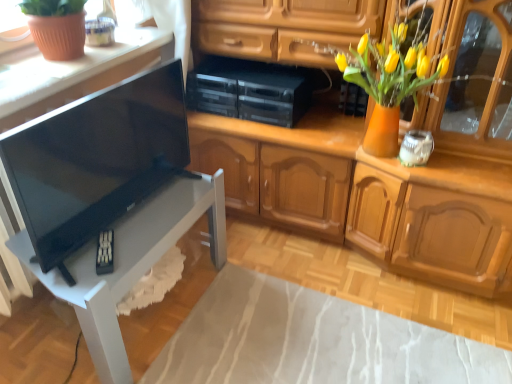
Question: Can you confirm if matte black speaker at upper center, the 2th appliance viewed from the right, is shorter than black plastic stereo at center, the first appliance from the left?

Choices:
 (A) yes
 (B) no

Answer: (B)

Question: Is matte black speaker at upper center, the 2th appliance viewed from the right, smaller than black plastic stereo at center, the first appliance from the left?

Choices:
 (A) yes
 (B) no

Answer: (A)

Question: Is matte black speaker at upper center, the 2th appliance viewed from the right, oriented towards black plastic stereo at center, the third appliance positioned from the right?

Choices:
 (A) no
 (B) yes

Answer: (A)

Question: From the image's perspective, is matte black speaker at upper center, which is the 2th appliance from left to right, located beneath black plastic stereo at center, the first appliance from the left?

Choices:
 (A) no
 (B) yes

Answer: (A)

Question: From a real-world perspective, is matte black speaker at upper center, which is the 2th appliance from left to right, on black plastic stereo at center, the third appliance positioned from the right?

Choices:
 (A) yes
 (B) no

Answer: (A)

Question: From the image's perspective, relative to black plastic stereo at center, the first appliance from the left, is black glossy tv at left above or below?

Choices:
 (A) below
 (B) above

Answer: (A)

Question: Considering the positions of black glossy tv at left and black plastic stereo at center, the first appliance from the left, in the image, is black glossy tv at left taller or shorter than black plastic stereo at center, the first appliance from the left,?

Choices:
 (A) short
 (B) tall

Answer: (B)

Question: From a real-world perspective, relative to black plastic stereo at center, the first appliance from the left, is black glossy tv at left vertically above or below?

Choices:
 (A) below
 (B) above

Answer: (B)

Question: Do you think black glossy tv at left is within black plastic stereo at center, the third appliance positioned from the right, or outside of it?

Choices:
 (A) inside
 (B) outside

Answer: (B)

Question: From their relative heights in the image, would you say white glossy table at lower left is taller or shorter than white glass jar at upper right, positioned as the 3th appliance in left-to-right order?

Choices:
 (A) tall
 (B) short

Answer: (A)

Question: Considering their positions, is white glossy table at lower left located in front of or behind white glass jar at upper right, the first appliance positioned from the right?

Choices:
 (A) front
 (B) behind

Answer: (A)

Question: Does point (142, 238) appear closer or farther from the camera than point (426, 135)?

Choices:
 (A) farther
 (B) closer

Answer: (B)

Question: From the image's perspective, relative to white glass jar at upper right, the first appliance positioned from the right, is white glossy table at lower left above or below?

Choices:
 (A) below
 (B) above

Answer: (A)

Question: Considering the positions of black plastic stereo at center, the first appliance from the left, and white glass jar at upper right, positioned as the 3th appliance in left-to-right order, in the image, is black plastic stereo at center, the first appliance from the left, taller or shorter than white glass jar at upper right, positioned as the 3th appliance in left-to-right order,?

Choices:
 (A) tall
 (B) short

Answer: (A)

Question: Is black plastic stereo at center, the third appliance positioned from the right, wider or thinner than white glass jar at upper right, the first appliance positioned from the right?

Choices:
 (A) wide
 (B) thin

Answer: (A)